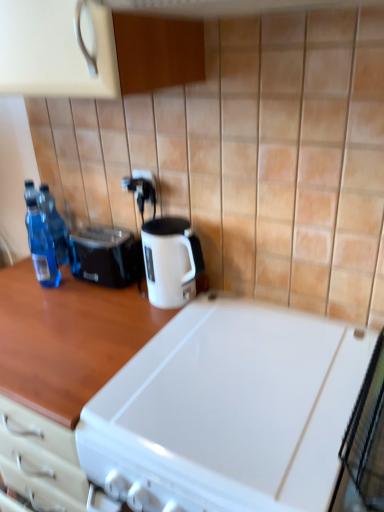
This screenshot has width=384, height=512. I want to click on empty space that is to the right of transparent plastic bottles at left, which is the first bottle from front to back, so click(94, 289).